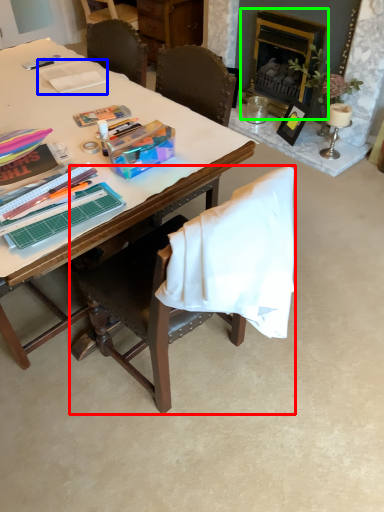
Question: Estimate the real-world distances between objects in this image. Which object is closer to chair (highlighted by a red box), paperback book (highlighted by a blue box) or fireplace (highlighted by a green box)?

Choices:
 (A) paperback book
 (B) fireplace

Answer: (A)